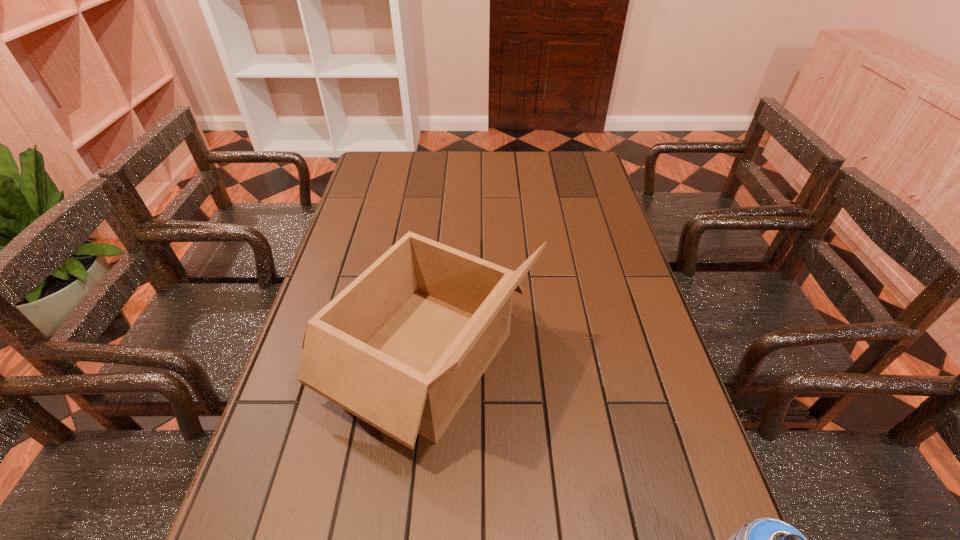
Where is `the left object`? the left object is located at coordinates (401, 347).

Where is `the taller object`? the taller object is located at coordinates (401, 347).

Identify the location of vacant region located 0.240m on the back of the left object. This screenshot has height=540, width=960. (440, 227).

Find the location of a particular element. Image resolution: width=960 pixels, height=540 pixels. object that is at the left edge is located at coordinates (401, 347).

Locate an element on the screen. vacant area at the far edge is located at coordinates (545, 164).

At what (x,y) coordinates should I click in order to perform the action: click on vacant region at the left edge of the desktop. Please return your answer as a coordinate pair (x, y). The image size is (960, 540). Looking at the image, I should click on (383, 238).

Locate an element on the screen. free spot at the right edge of the desktop is located at coordinates (617, 389).

Where is `blank area at the far left corner`? This screenshot has height=540, width=960. blank area at the far left corner is located at coordinates (375, 173).

Locate an element on the screen. This screenshot has width=960, height=540. vacant space at the far right corner is located at coordinates (560, 153).